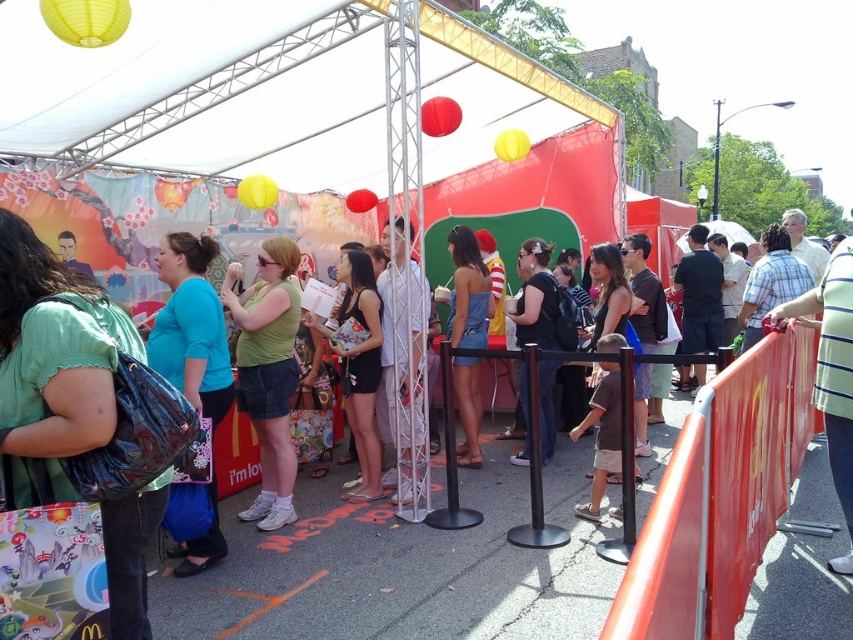
Question: Which point appears farthest from the camera in this image?

Choices:
 (A) (264, 410)
 (B) (788, 380)
 (C) (546, 436)

Answer: (C)

Question: Which object appears closest to the camera in this image?

Choices:
 (A) green fabric shirt at center
 (B) matte black backpack at center

Answer: (A)

Question: Is green fabric shirt at center positioned at the back of orange matte line at lower center?

Choices:
 (A) no
 (B) yes

Answer: (A)

Question: From the image, what is the correct spatial relationship of denim shorts at center in relation to brown cotton shirt at center?

Choices:
 (A) above
 (B) below

Answer: (A)

Question: Estimate the real-world distances between objects in this image. Which object is farther from the orange matte line at lower center?

Choices:
 (A) matte black backpack at center
 (B) denim shorts at center
 (C) green fabric shirt at center
 (D) red plastic barricade at right

Answer: (A)

Question: Can you confirm if blue fabric purse at center is positioned to the left of white matte shirt at center?

Choices:
 (A) no
 (B) yes

Answer: (B)